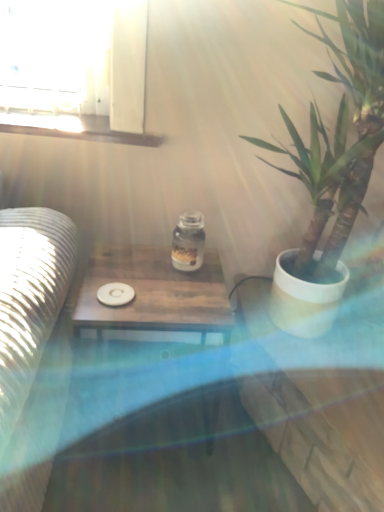
Question: Is point [178, 261] positioned closer to the camera than point [144, 328]?

Choices:
 (A) farther
 (B) closer

Answer: (A)

Question: Visually, is transparent glass jar at center positioned to the left or to the right of wooden table at center?

Choices:
 (A) right
 (B) left

Answer: (A)

Question: Which object is the farthest from the wooden table at center?

Choices:
 (A) white matte coaster at center
 (B) green leafy plant in white pot at right
 (C) transparent glass jar at center

Answer: (B)

Question: Which is farther from the transparent glass jar at center?

Choices:
 (A) green leafy plant in white pot at right
 (B) wooden table at center
 (C) white matte coaster at center

Answer: (A)